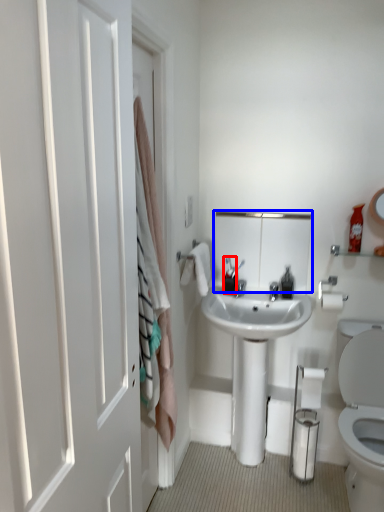
Question: Which object appears closest to the camera in this image, toiletry (highlighted by a red box) or medicine cabinet (highlighted by a blue box)?

Choices:
 (A) toiletry
 (B) medicine cabinet

Answer: (B)